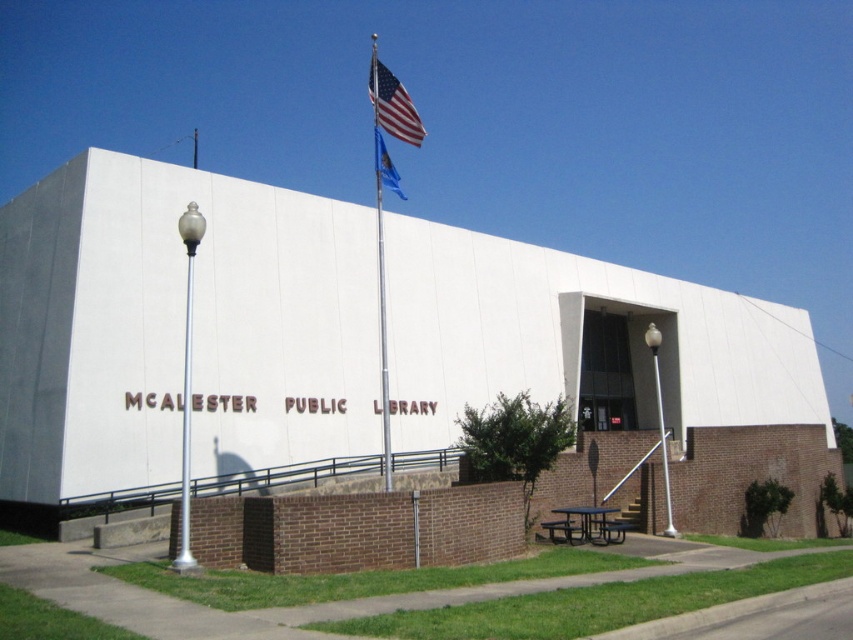
Question: Which object is farther from the camera taking this photo?

Choices:
 (A) silver metallic pole at left
 (B) blue fabric flag at upper center

Answer: (B)

Question: Based on their relative distances, which object is nearer to the american flag at upper center?

Choices:
 (A) silver metallic pole at left
 (B) blue fabric flag at upper center
 (C) silver metallic flag pole at upper center

Answer: (C)

Question: Is silver metallic flag pole at upper center to the right of american flag at upper center from the viewer's perspective?

Choices:
 (A) yes
 (B) no

Answer: (A)

Question: Can you confirm if silver metallic flag pole at upper center is bigger than silver metallic pole at left?

Choices:
 (A) no
 (B) yes

Answer: (B)

Question: Can you confirm if silver metallic flag pole at upper center is smaller than silver metallic pole at left?

Choices:
 (A) no
 (B) yes

Answer: (A)

Question: Based on their relative distances, which object is farther from the blue fabric flag at upper center?

Choices:
 (A) american flag at upper center
 (B) silver metallic flag pole at upper center
 (C) silver metallic pole at left

Answer: (C)